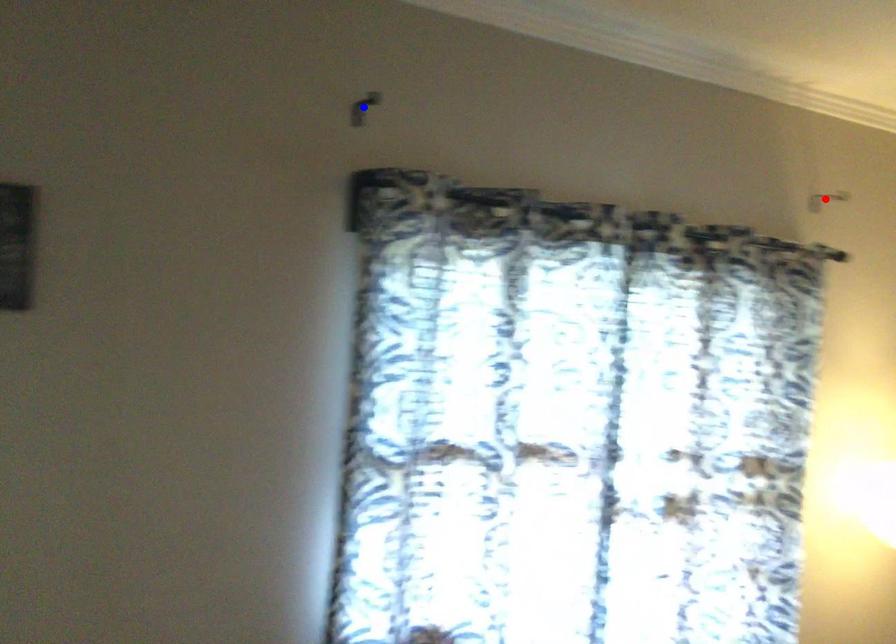
Question: In the image, two points are highlighted. Which point is nearer to the camera? Reply with the corresponding letter.

Choices:
 (A) blue point
 (B) red point

Answer: (A)